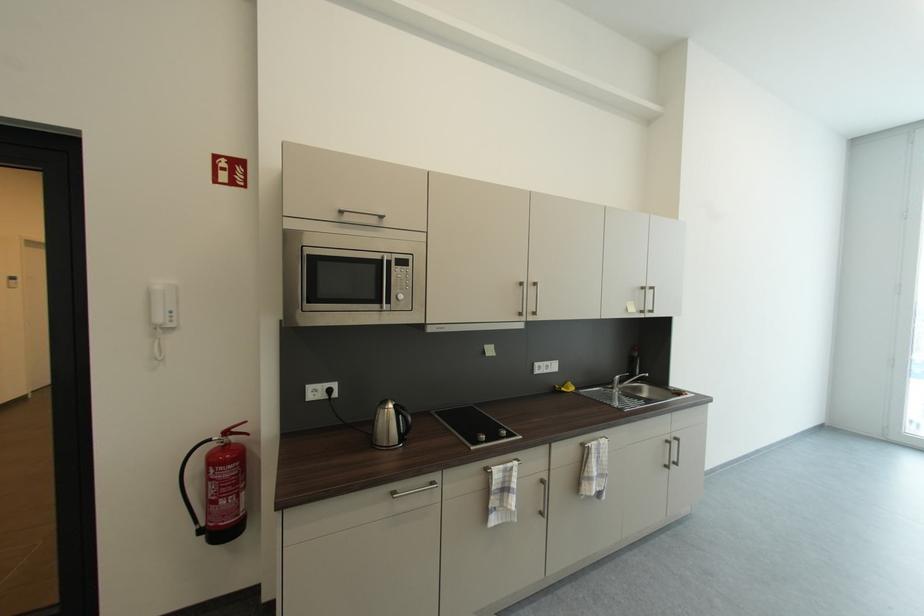
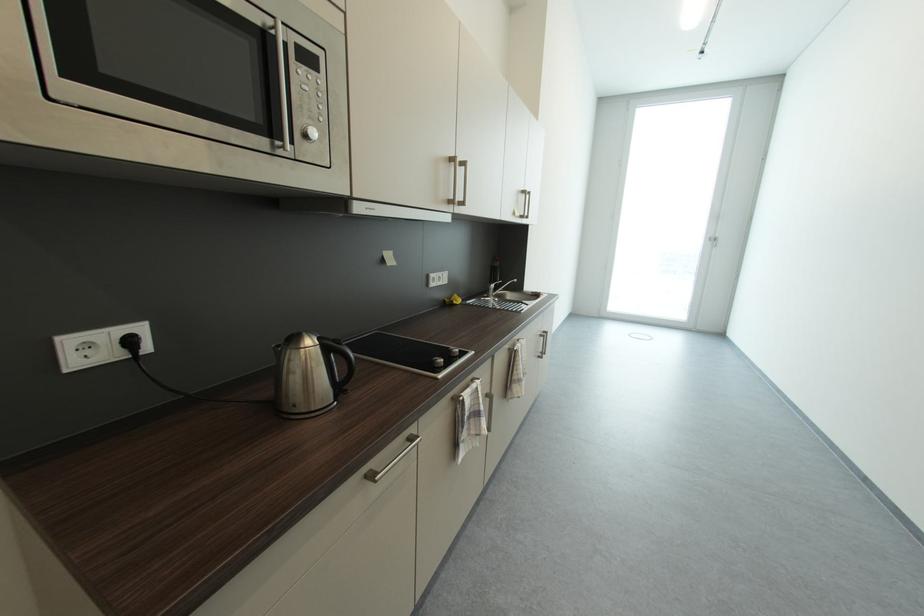
Where in the second image is the point corresponding to pixel 400 407 from the first image?

(323, 342)